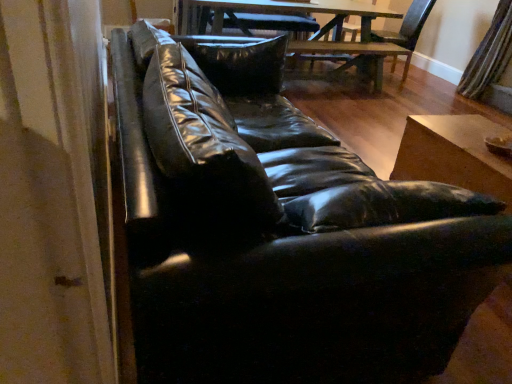
Question: From the image's perspective, is wooden table at lower right, placed as the 2th table when sorted from back to front, located above or below dark wood swivel chair at center?

Choices:
 (A) below
 (B) above

Answer: (A)

Question: Is wooden table at lower right, placed as the 2th table when sorted from back to front, in front of or behind dark wood swivel chair at center in the image?

Choices:
 (A) behind
 (B) front

Answer: (B)

Question: Which object is the farthest from the wooden table at center, which is the 2th table from front to back?

Choices:
 (A) wooden table at lower right, which appears as the first table when ordered from the bottom
 (B) striped fabric curtain at right
 (C) dark wood swivel chair at center

Answer: (A)

Question: Considering the real-world distances, which object is farthest from the dark wood swivel chair at center?

Choices:
 (A) striped fabric curtain at right
 (B) wooden table at lower right, which is counted as the first table, starting from the front
 (C) wooden table at center, which ranks as the first table in back-to-front order

Answer: (B)